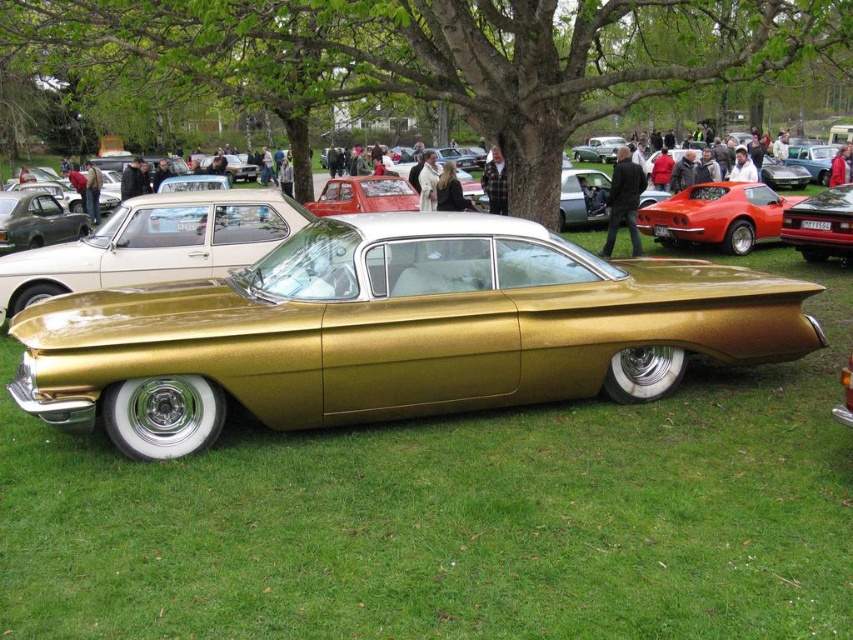
Is gold metallic car at center wider than green leafy tree at center?

In fact, gold metallic car at center might be narrower than green leafy tree at center.

How far apart are gold metallic car at center and green leafy tree at center?

Answer: The distance of gold metallic car at center from green leafy tree at center is 3.66 meters.

Which is behind, point (259, 387) or point (302, 10)?

Point (302, 10)

This screenshot has height=640, width=853. I want to click on gold metallic car at center, so click(393, 332).

Which is in front, point (798, 45) or point (672, 204)?

Point (798, 45)

Between green leafy tree at center and shiny red car at right, which one appears on the right side from the viewer's perspective?

From the viewer's perspective, shiny red car at right appears more on the right side.

Does point (264, 83) come farther from viewer compared to point (660, 204)?

No, (264, 83) is in front of (660, 204).

Find the location of a particular element. The image size is (853, 640). green leafy tree at center is located at coordinates (444, 54).

Does gold metallic car at center come behind shiny red car at center?

No, gold metallic car at center is closer to the viewer.

Can you confirm if gold metallic car at center is smaller than shiny red car at center?

Incorrect, gold metallic car at center is not smaller in size than shiny red car at center.

Where is `gold metallic car at center`? gold metallic car at center is located at coordinates (393, 332).